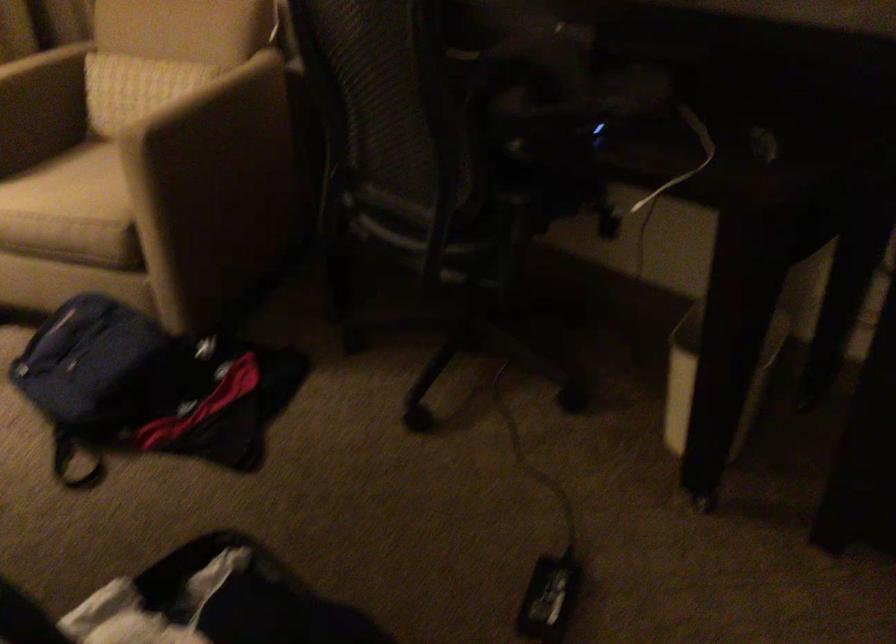
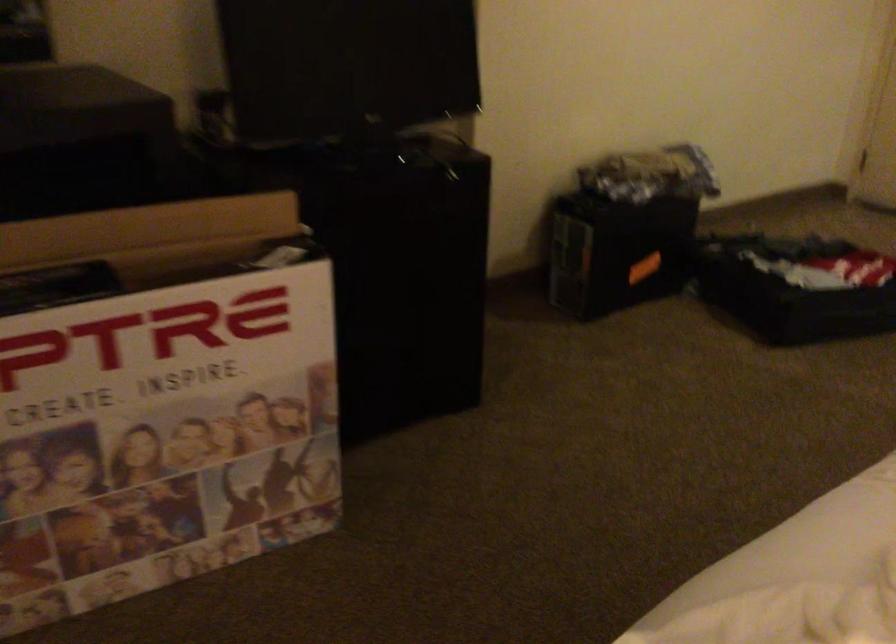
Question: The first image is from the beginning of the video and the second image is from the end. How did the camera likely rotate when shooting the video?

Choices:
 (A) Left
 (B) Right
 (C) Up
 (D) Down

Answer: (B)